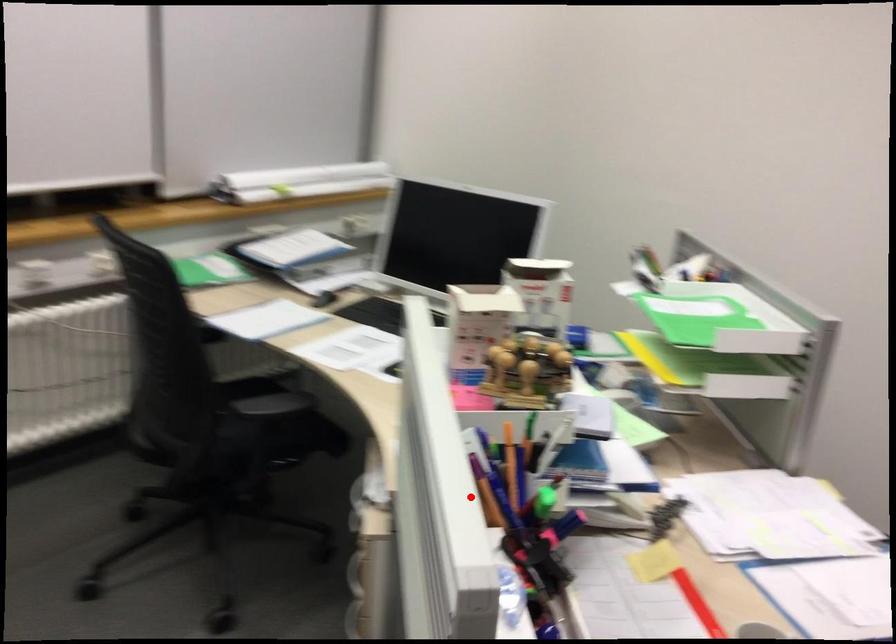
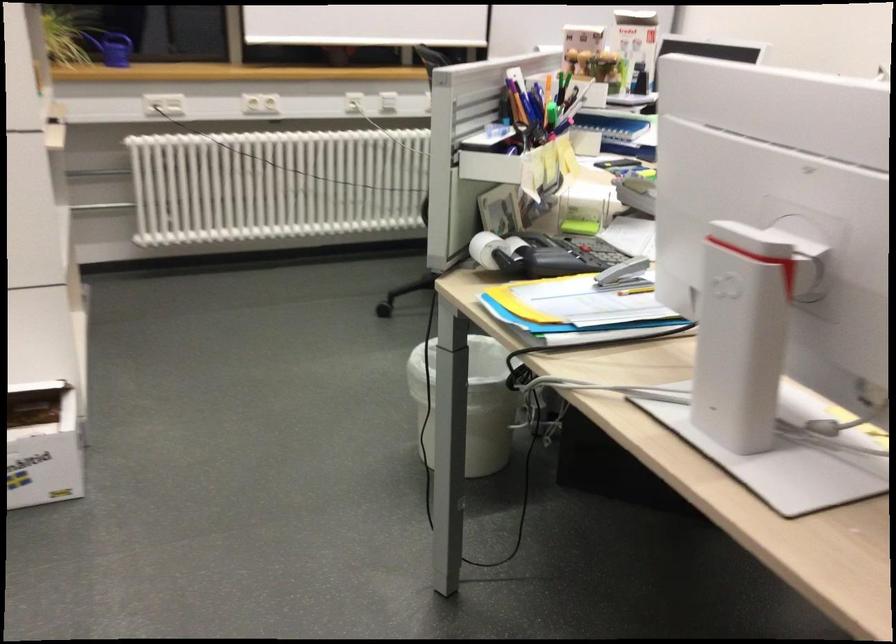
Question: A red point is marked in image1. In image2, is the corresponding 3D point closer to the camera or farther? Reply with the corresponding letter.

Choices:
 (A) The corresponding 3D point is closer.
 (B) The corresponding 3D point is farther.

Answer: (B)